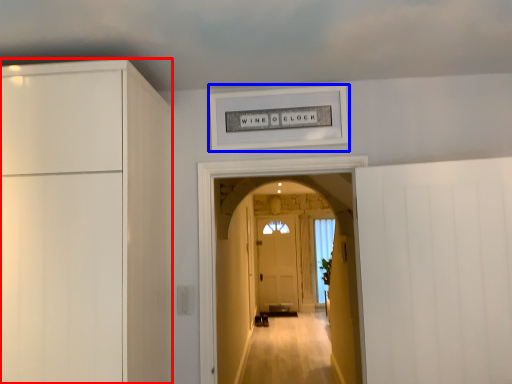
Question: Among these objects, which one is farthest to the camera, cabinetry (highlighted by a red box) or picture frame (highlighted by a blue box)?

Choices:
 (A) cabinetry
 (B) picture frame

Answer: (B)